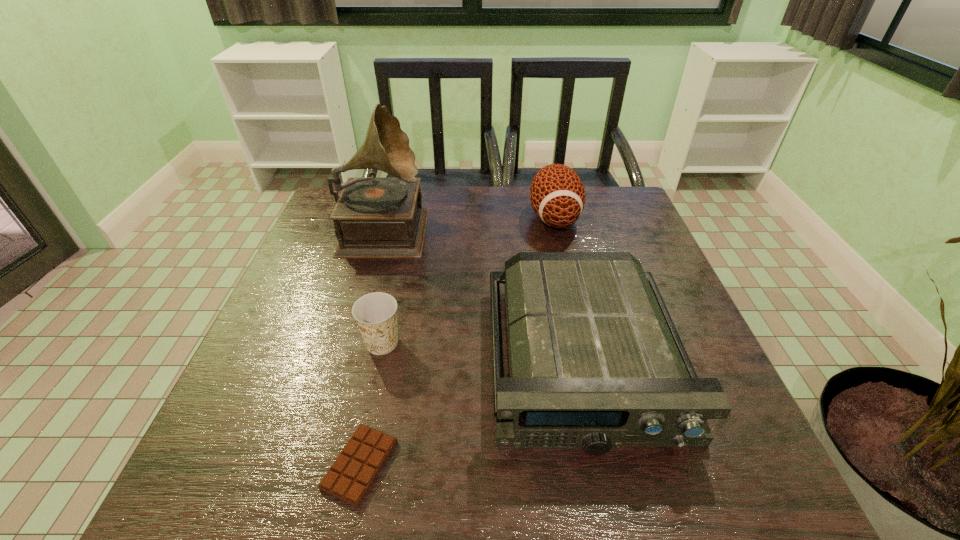
Where is `vacant area between the Dixie cup and the candy bar`? The image size is (960, 540). vacant area between the Dixie cup and the candy bar is located at coordinates (372, 404).

Where is `vacant area between the record player and the Dixie cup`? The height and width of the screenshot is (540, 960). vacant area between the record player and the Dixie cup is located at coordinates (383, 285).

Identify the location of the fourth closest object to the Dixie cup. (557, 195).

You are a GUI agent. You are given a task and a screenshot of the screen. Output one action in this format:
    pyautogui.click(x=<x>, y=<y>)
    Task: Click on the object that ranks as the third closest to the candy bar
    Image resolution: width=960 pixels, height=540 pixels.
    Given the screenshot: What is the action you would take?
    pyautogui.click(x=374, y=217)

Identify the location of vacant space that satisfies the following two spatial constraints: 1. from the horn of the Dixie cup; 2. on the right side of the record player. (351, 343).

The width and height of the screenshot is (960, 540). Find the location of `free location that satisfies the following two spatial constraints: 1. from the horn of the tallest object; 2. on the right side of the Dixie cup`. free location that satisfies the following two spatial constraints: 1. from the horn of the tallest object; 2. on the right side of the Dixie cup is located at coordinates point(351,343).

Identify the location of free space that satisfies the following two spatial constraints: 1. from the horn of the tallest object; 2. on the right side of the Dixie cup. The width and height of the screenshot is (960, 540). (351, 343).

At what (x,y) coordinates should I click in order to perform the action: click on vacant space that satisfies the following two spatial constraints: 1. on the front side of the Dixie cup; 2. on the right side of the candy bar. Please return your answer as a coordinate pair (x, y). This screenshot has height=540, width=960. Looking at the image, I should click on (355, 464).